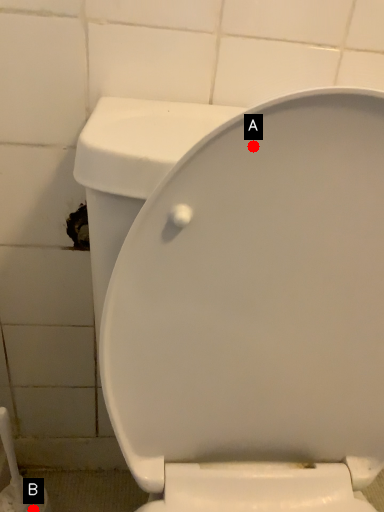
Question: Two points are circled on the image, labeled by A and B beside each circle. Which point is further to the camera?

Choices:
 (A) A is further
 (B) B is further

Answer: (B)